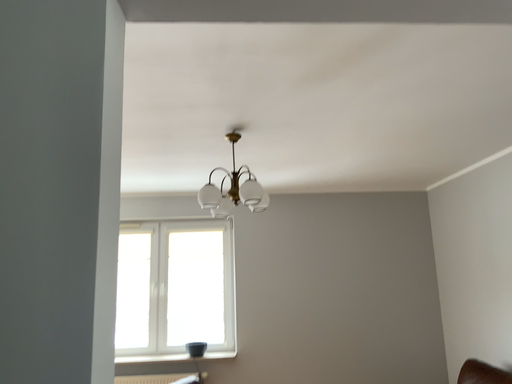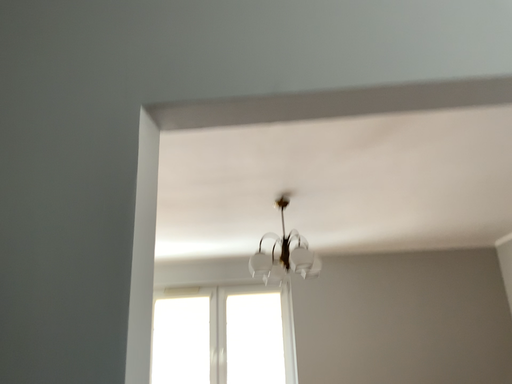
Question: How did the camera likely rotate when shooting the video?

Choices:
 (A) rotated upward
 (B) rotated downward

Answer: (A)